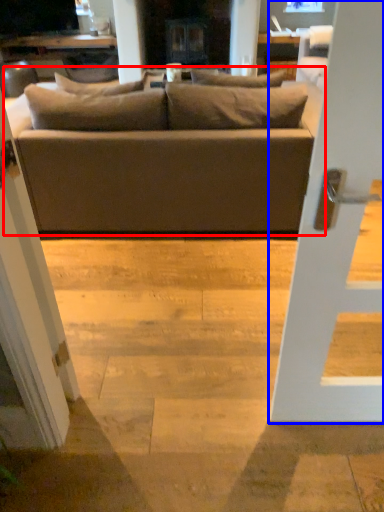
Question: Which of the following is the closest to the observer, studio couch (highlighted by a red box) or door (highlighted by a blue box)?

Choices:
 (A) studio couch
 (B) door

Answer: (B)